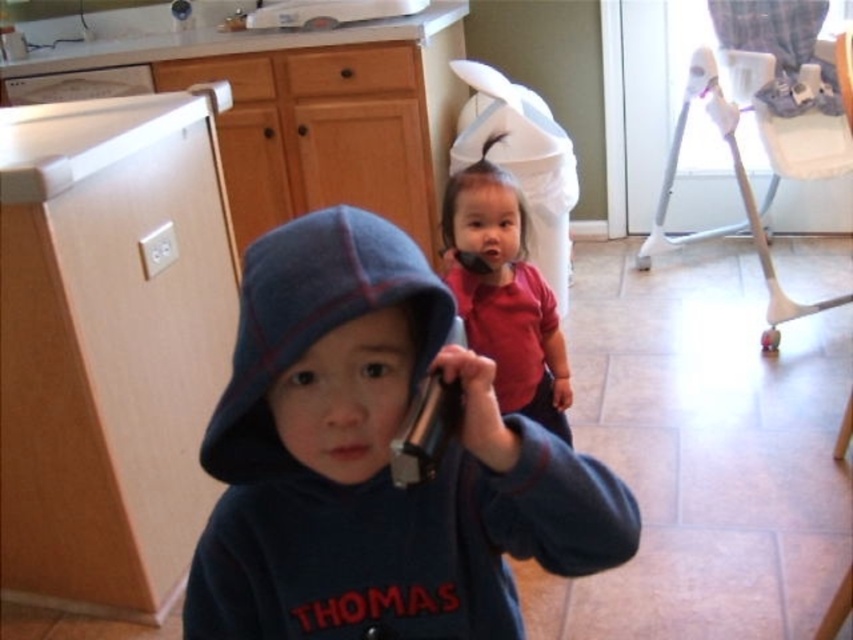
Is dark blue fleece hoodie at center wider than red matte shirt at center?

Yes.

Locate an element on the screen. The width and height of the screenshot is (853, 640). dark blue fleece hoodie at center is located at coordinates (375, 460).

Is point (469, 490) positioned in front of point (532, 358)?

Yes, it is in front of point (532, 358).

Locate an element on the screen. The width and height of the screenshot is (853, 640). dark blue fleece hoodie at center is located at coordinates (375, 460).